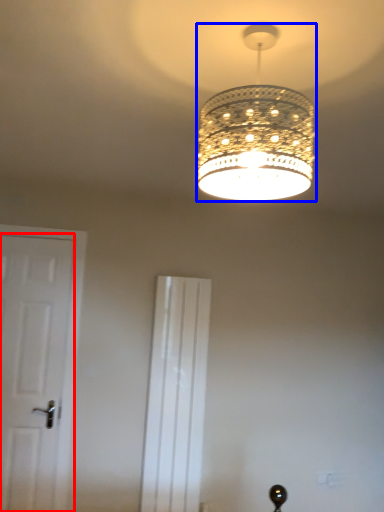
Question: Which object appears farthest to the camera in this image, door (highlighted by a red box) or lamp (highlighted by a blue box)?

Choices:
 (A) door
 (B) lamp

Answer: (A)